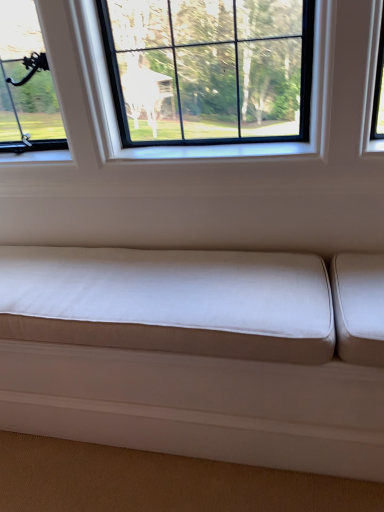
This screenshot has height=512, width=384. What do you see at coordinates (185, 357) in the screenshot? I see `white fabric studio couch at lower center` at bounding box center [185, 357].

This screenshot has width=384, height=512. What are the coordinates of `white fabric studio couch at lower center` in the screenshot? It's located at (185, 357).

The width and height of the screenshot is (384, 512). I want to click on white fabric studio couch at lower center, so click(185, 357).